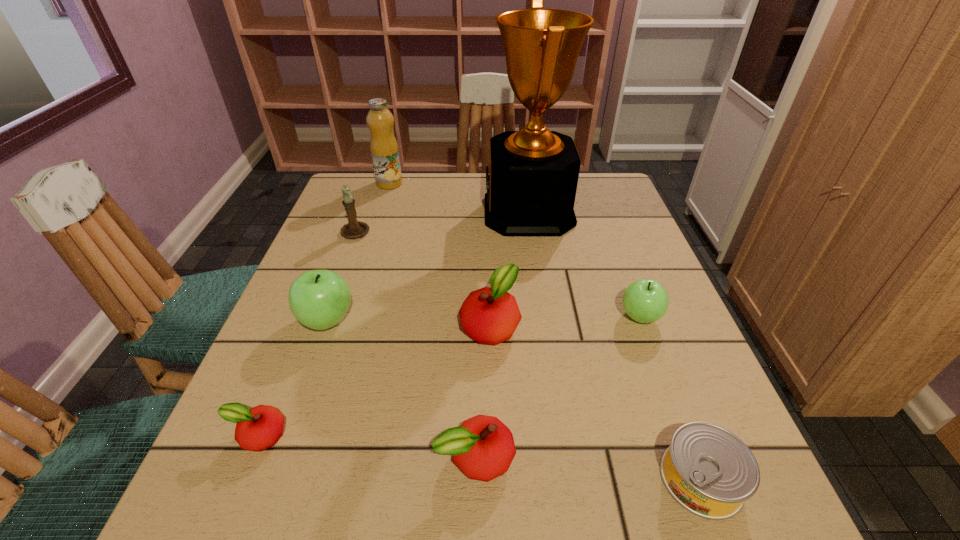
Where is `free location located on the back of the bigger green apple`? The height and width of the screenshot is (540, 960). free location located on the back of the bigger green apple is located at coordinates (349, 259).

This screenshot has width=960, height=540. Identify the location of free point located 0.170m on the back of the biggest red apple. (488, 250).

This screenshot has width=960, height=540. Find the location of `free space located 0.100m on the back of the rightmost apple`. free space located 0.100m on the back of the rightmost apple is located at coordinates (623, 271).

Find the location of a particular element. vacant region located on the back of the second smallest red apple is located at coordinates (476, 359).

Identify the location of free spot located on the back of the leftmost red apple. The height and width of the screenshot is (540, 960). (323, 279).

Locate an element on the screen. vacant space located on the back of the silver can is located at coordinates (640, 316).

This screenshot has width=960, height=540. I want to click on trophy cup that is positioned at the far edge, so click(531, 181).

This screenshot has height=540, width=960. Find the location of `fruit juice at the far edge`. fruit juice at the far edge is located at coordinates (384, 149).

The height and width of the screenshot is (540, 960). Identify the location of apple that is at the near edge. (483, 447).

The height and width of the screenshot is (540, 960). What are the coordinates of `can at the near edge` in the screenshot? It's located at (708, 470).